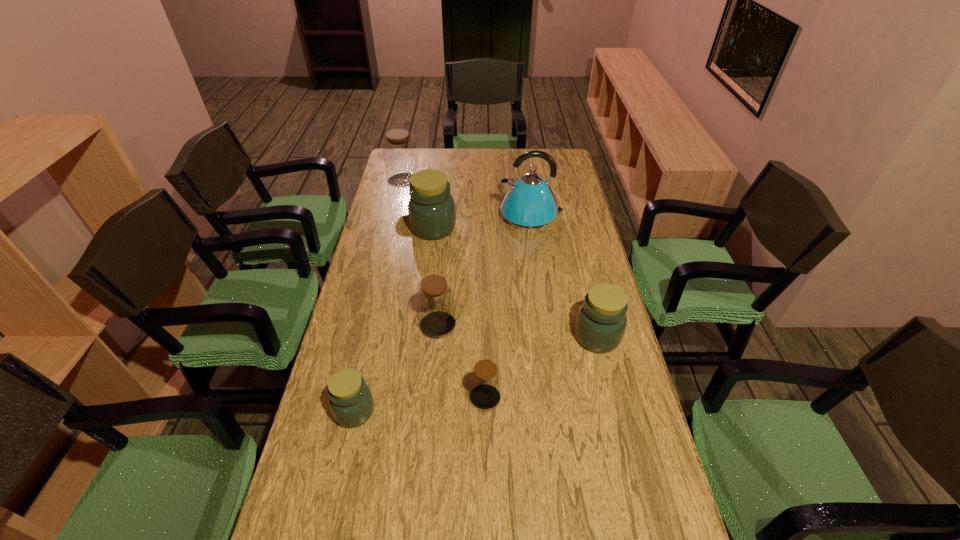
The image size is (960, 540). Find the location of `the fifth jar from left to right`. the fifth jar from left to right is located at coordinates [x=485, y=379].

The image size is (960, 540). Identify the location of the smallest green jar. (351, 402).

You are a GUI agent. You are given a task and a screenshot of the screen. Output one action in this format:
    pyautogui.click(x=<x>, y=<y>)
    Task: Click on the nearest green jar
    This screenshot has height=540, width=960.
    Given the screenshot: What is the action you would take?
    pyautogui.click(x=351, y=402)

You are a GUI agent. You are given a task and a screenshot of the screen. Output one action in this format:
    pyautogui.click(x=<x>, y=<y>)
    Task: Click on the free region located at the spout of the tallest object
    The image size is (960, 540).
    Given the screenshot: What is the action you would take?
    click(487, 216)

At what (x,y) coordinates should I click in order to perform the action: click on free spot located at the spout of the tallest object. Please return your answer as a coordinate pair (x, y). The image size is (960, 540). Looking at the image, I should click on (487, 216).

Locate an element on the screen. The height and width of the screenshot is (540, 960). vacant space located at the spout of the tallest object is located at coordinates (452, 216).

Locate an element on the screen. free space located 0.240m on the front of the farthest brown jar is located at coordinates (394, 223).

The width and height of the screenshot is (960, 540). I want to click on free region located 0.260m on the back of the biggest green jar, so 440,180.

This screenshot has width=960, height=540. In order to click on vacant space situated 0.190m on the left of the second brown jar from left to right in this screenshot , I will do `click(359, 325)`.

Identify the location of free space located on the back of the second farthest green jar. The height and width of the screenshot is (540, 960). (583, 277).